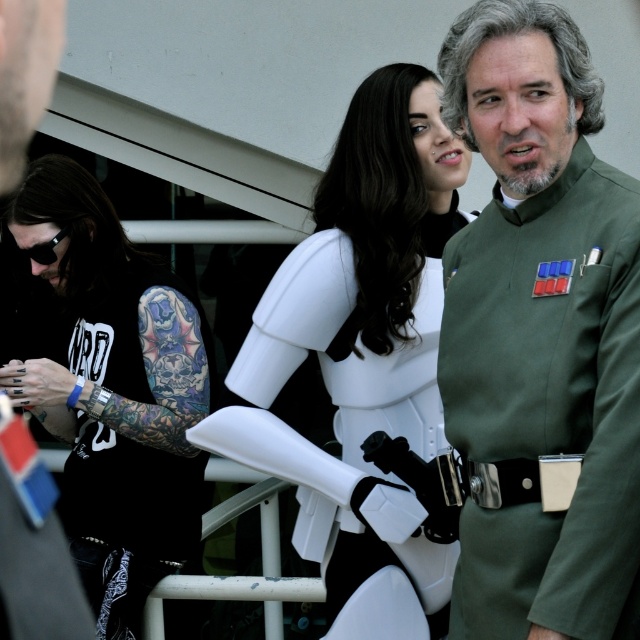
Question: Is white matte stormtrooper armor at center to the left of white matte armor at center from the viewer's perspective?

Choices:
 (A) no
 (B) yes

Answer: (B)

Question: Which of the following is the closest to the observer?

Choices:
 (A) white matte stormtrooper armor at center
 (B) matte green uniform at center right
 (C) green matte uniform at center

Answer: (B)

Question: Considering the relative positions of white matte armor at center and matte green uniform at center right in the image provided, where is white matte armor at center located with respect to matte green uniform at center right?

Choices:
 (A) left
 (B) right

Answer: (B)

Question: Among these points, which one is farthest from the camera?

Choices:
 (A) (93, 378)
 (B) (321, 216)
 (C) (61, 22)

Answer: (A)

Question: Which of the following is the farthest from the observer?

Choices:
 (A) matte green uniform at center right
 (B) green matte uniform at center
 (C) white matte armor at center

Answer: (C)

Question: Does green matte uniform at center lie in front of matte green uniform at center right?

Choices:
 (A) no
 (B) yes

Answer: (A)